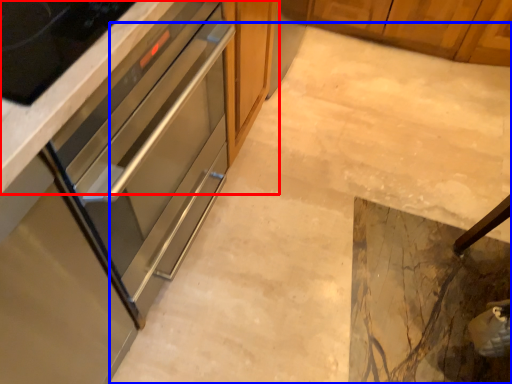
Question: Which object is closer to the camera taking this photo, cabinetry (highlighted by a red box) or concrete (highlighted by a blue box)?

Choices:
 (A) cabinetry
 (B) concrete

Answer: (B)